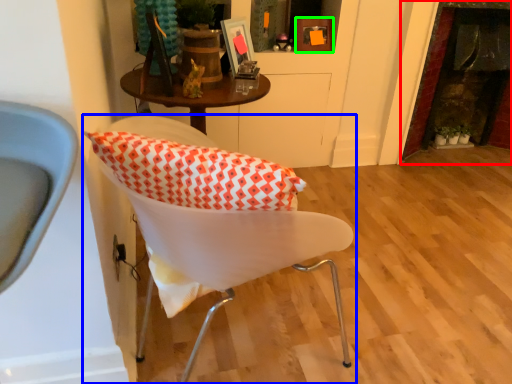
Question: Which object is the farthest from fireplace (highlighted by a red box)? Choose among these: chair (highlighted by a blue box) or picture frame (highlighted by a green box).

Choices:
 (A) chair
 (B) picture frame

Answer: (A)